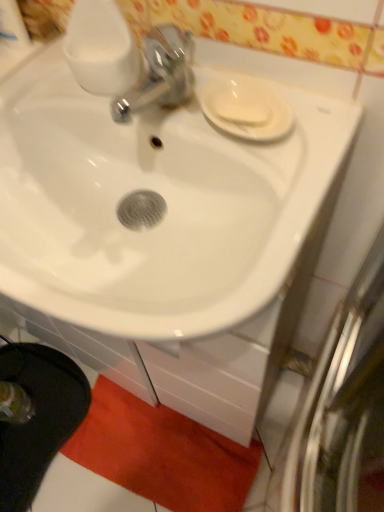
Image resolution: width=384 pixels, height=512 pixels. Find the location of `free space in front of white matte soap at upper right`. free space in front of white matte soap at upper right is located at coordinates (275, 175).